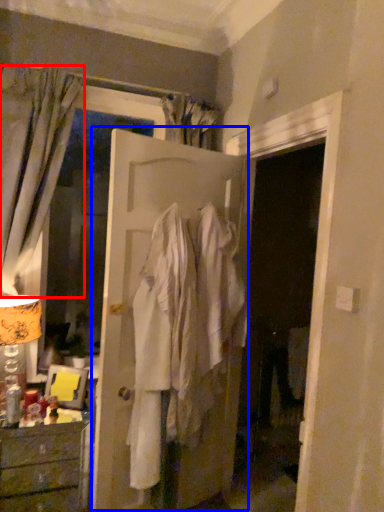
Question: Which object appears closest to the camera in this image, curtain (highlighted by a red box) or door (highlighted by a blue box)?

Choices:
 (A) curtain
 (B) door

Answer: (B)